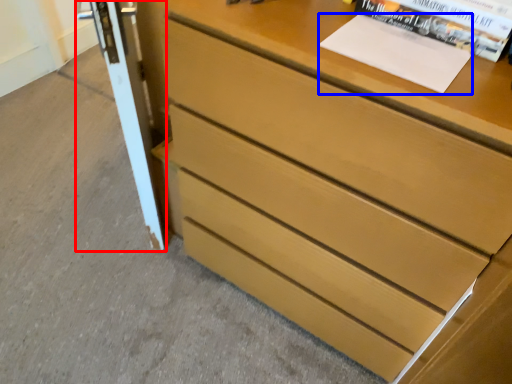
Question: Which of the following is the farthest to the observer, screen door (highlighted by a red box) or paperback book (highlighted by a blue box)?

Choices:
 (A) screen door
 (B) paperback book

Answer: (A)